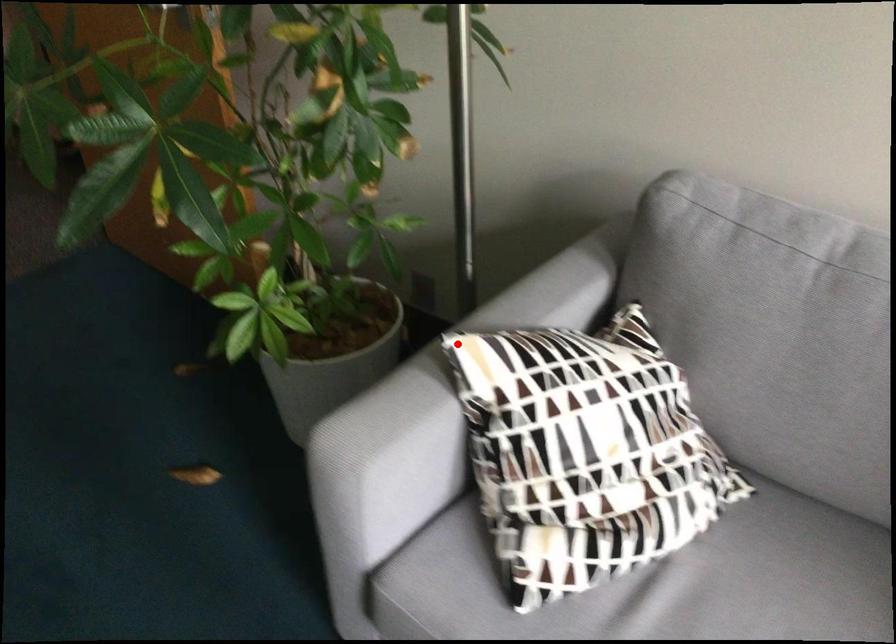
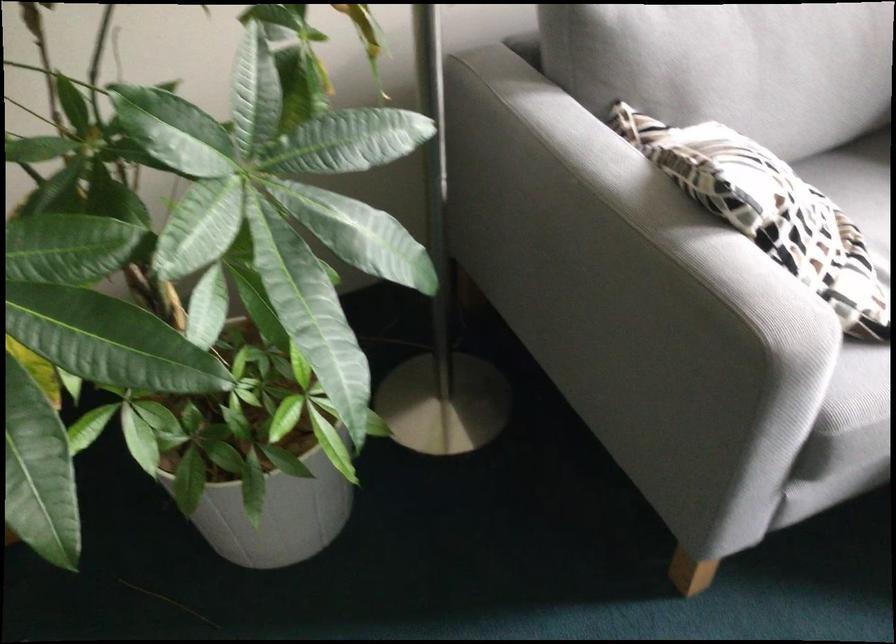
Locate, in the second image, the point that corresponds to the highlighted location in the first image.

(604, 240)